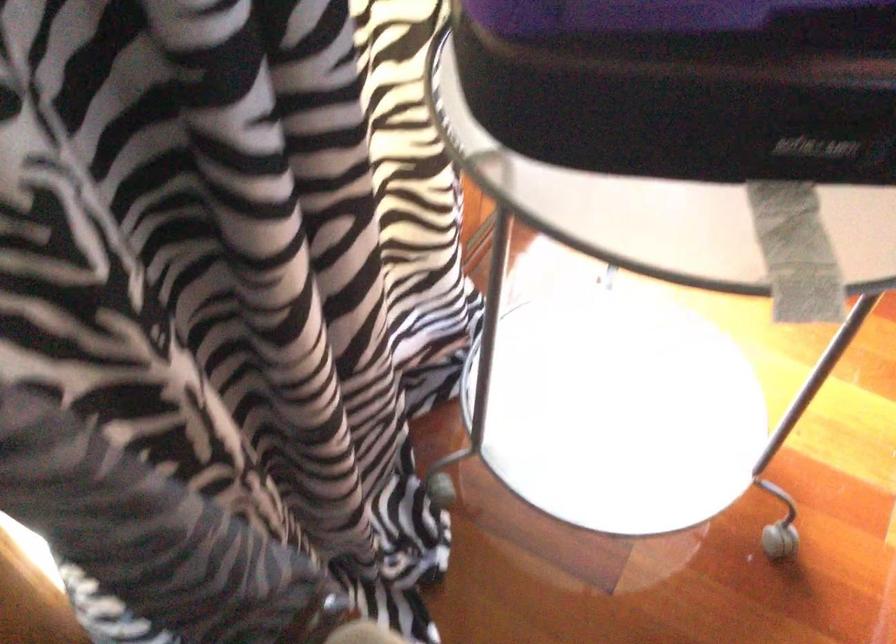
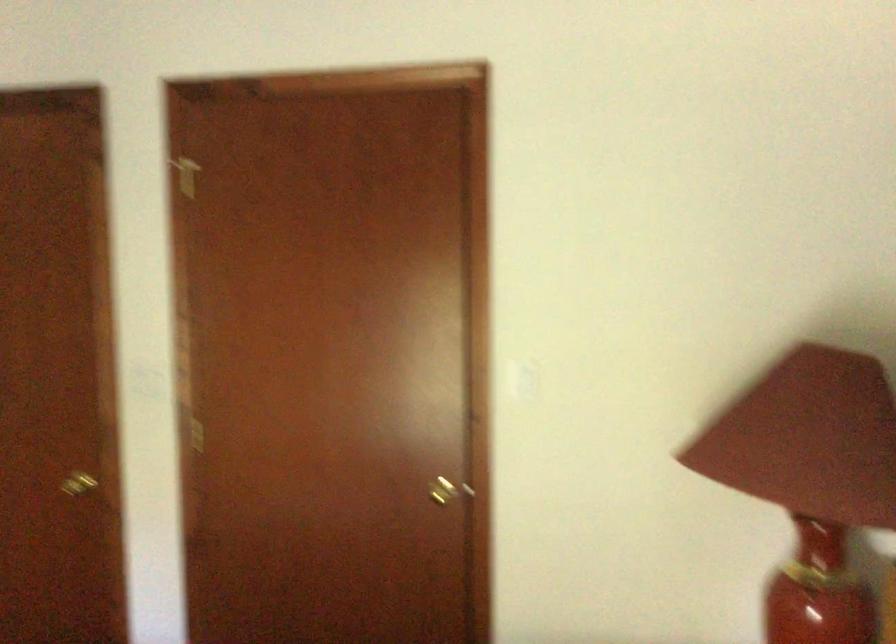
First-person continuous shooting, in which direction is the camera rotating?

The rotation direction of the camera is right-down.